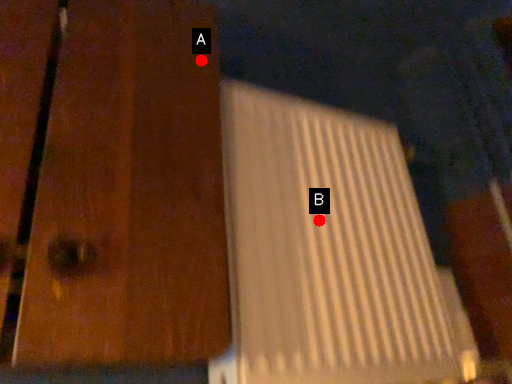
Question: Two points are circled on the image, labeled by A and B beside each circle. Among these points, which one is farthest from the camera?

Choices:
 (A) A is further
 (B) B is further

Answer: (B)